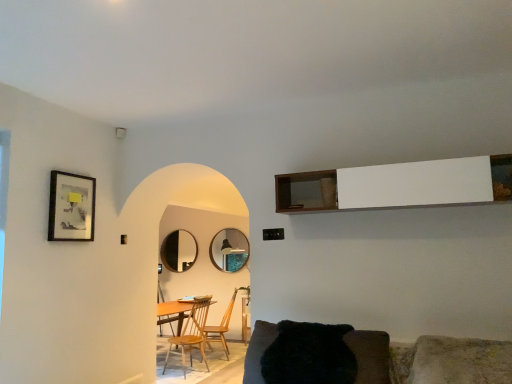
This screenshot has width=512, height=384. In order to click on matte black picture frame at upper left in this screenshot , I will do `click(71, 207)`.

What do you see at coordinates (221, 327) in the screenshot?
I see `wooden chair at center, acting as the second chair starting from the left` at bounding box center [221, 327].

Describe the element at coordinates (179, 251) in the screenshot. Image resolution: width=512 pixels, height=384 pixels. I see `matte black mirror at center, the first mirror when ordered from left to right` at that location.

The image size is (512, 384). I want to click on wooden at left, the 3th chair when ordered from right to left, so click(x=192, y=334).

From the picture: What is the approximate height of white wood cabinet at upper center?

13.22 inches.

In order to face white wood cabinet at upper center, should I rotate leftwards or rightwards?

Rotate your view right by about 16.617°.

Identify the location of matte silver mirror at center, which is the second mirror from back to front. The image size is (512, 384). (229, 250).

Considering the positions of points (85, 234) and (178, 240), is point (85, 234) farther from camera compared to point (178, 240)?

No, (85, 234) is closer to viewer.

Are matte black picture frame at upper left and matte black mirror at center, which is the 2th mirror in right-to-left order, beside each other?

They are not placed beside each other.

Could you tell me if matte black picture frame at upper left is facing matte black mirror at center, which is the 2th mirror in right-to-left order?

No, matte black picture frame at upper left is not aimed at matte black mirror at center, which is the 2th mirror in right-to-left order.

Is wooden chair at center, the second chair positioned from the right, far away from wooden at left, the 1th chair positioned from the left?

They are positioned close to each other.

Is point (228, 324) farther from camera compared to point (197, 329)?

Yes, it is.

Does wooden chair at center, the 1th chair viewed from the back, appear on the right side of wooden at left, the second chair when ordered from front to back?

Yes, wooden chair at center, the 1th chair viewed from the back, is to the right of wooden at left, the second chair when ordered from front to back.

Considering the sizes of objects wooden chair at center, which is the third chair from front to back, and wooden at left, the 1th chair positioned from the left, in the image provided, who is shorter, wooden chair at center, which is the third chair from front to back, or wooden at left, the 1th chair positioned from the left,?

With less height is wooden chair at center, which is the third chair from front to back.

Does wooden at left, the second chair when ordered from front to back, have a greater width compared to wooden chair at center, the 1th chair viewed from the back?

Correct, the width of wooden at left, the second chair when ordered from front to back, exceeds that of wooden chair at center, the 1th chair viewed from the back.

From the image's perspective, does wooden at left, arranged as the 2th chair when viewed from the back, appear lower than wooden chair at center, which is the third chair from front to back?

Actually, wooden at left, arranged as the 2th chair when viewed from the back, appears above wooden chair at center, which is the third chair from front to back, in the image.

Which point is more distant from viewer, (195, 312) or (205, 334)?

Positioned behind is point (195, 312).

Between wooden at left, arranged as the 2th chair when viewed from the back, and wooden chair at center, the 1th chair viewed from the back, which one appears on the right side from the viewer's perspective?

wooden chair at center, the 1th chair viewed from the back.

Is matte black mirror at center, which is the 2th mirror in right-to-left order, next to matte black picture frame at upper left?

matte black mirror at center, which is the 2th mirror in right-to-left order, and matte black picture frame at upper left are not in contact.

From a real-world perspective, which object stands above the other?

matte black picture frame at upper left, from a real-world perspective.

Would you say matte black mirror at center, which is the 1th mirror in back-to-front order, is outside matte black picture frame at upper left?

matte black mirror at center, which is the 1th mirror in back-to-front order, is positioned outside matte black picture frame at upper left.

Is point (170, 260) positioned in front of point (75, 201)?

No, (170, 260) is behind (75, 201).

In the scene shown: Can you see white wood cabinet at upper center touching matte silver mirror at center, which is the second mirror from back to front?

No, white wood cabinet at upper center is not in contact with matte silver mirror at center, which is the second mirror from back to front.

From the white wood cabinet at upper center, count the 1st mirror to the left and point to it. Please provide its 2D coordinates.

[(229, 250)]

Considering the relative sizes of white wood cabinet at upper center and matte silver mirror at center, which is the second mirror in left-to-right order, in the image provided, is white wood cabinet at upper center smaller than matte silver mirror at center, which is the second mirror in left-to-right order,?

Incorrect, white wood cabinet at upper center is not smaller in size than matte silver mirror at center, which is the second mirror in left-to-right order.

How many degrees apart are the facing directions of white wood cabinet at upper center and matte silver mirror at center, which is the second mirror in left-to-right order?

white wood cabinet at upper center and matte silver mirror at center, which is the second mirror in left-to-right order, are facing 0.865 degrees away from each other.

Is wooden at left, arranged as the 2th chair when viewed from the back, positioned beyond the bounds of matte black picture frame at upper left?

Yes, wooden at left, arranged as the 2th chair when viewed from the back, is located beyond the bounds of matte black picture frame at upper left.

Does wooden at left, the 1th chair positioned from the left, have a larger size compared to matte black picture frame at upper left?

Correct, wooden at left, the 1th chair positioned from the left, is larger in size than matte black picture frame at upper left.

Which is in front, point (187, 330) or point (58, 203)?

The point (58, 203) is closer.

Does wooden at left, the 3th chair when ordered from right to left, come in front of matte black picture frame at upper left?

That is False.

Who is smaller, white wood cabinet at upper center or matte black mirror at center, which is counted as the 2th mirror, starting from the front?

matte black mirror at center, which is counted as the 2th mirror, starting from the front.

Can you confirm if white wood cabinet at upper center is taller than matte black mirror at center, which is the 2th mirror in right-to-left order?

Incorrect, the height of white wood cabinet at upper center is not larger of that of matte black mirror at center, which is the 2th mirror in right-to-left order.

From the image's perspective, who appears lower, white wood cabinet at upper center or matte black mirror at center, which is the 1th mirror in back-to-front order?

matte black mirror at center, which is the 1th mirror in back-to-front order, from the image's perspective.

The image size is (512, 384). What are the coordinates of `the 2nd mirror behind the matte black picture frame at upper left` in the screenshot? It's located at (179, 251).

At what (x,y) coordinates should I click in order to perform the action: click on chair that is the 1st object above the wooden at left, the 3th chair when ordered from right to left (from a real-world perspective). Please return your answer as a coordinate pair (x, y). This screenshot has width=512, height=384. Looking at the image, I should click on (221, 327).

From the image, which object appears to be nearer to black furry chair at lower center, which appears as the third chair when viewed from the left, matte black picture frame at upper left or matte silver mirror at center, which is the second mirror in left-to-right order?

matte black picture frame at upper left is closer to black furry chair at lower center, which appears as the third chair when viewed from the left.

Which object lies further to the anchor point matte silver mirror at center, acting as the first mirror starting from the right, wooden chair at center, acting as the second chair starting from the left, or white wood cabinet at upper center?

Among the two, white wood cabinet at upper center is located further to matte silver mirror at center, acting as the first mirror starting from the right.

Looking at the image, which one is located further to matte black picture frame at upper left, wooden at left, the 3th chair when ordered from right to left, or matte silver mirror at center, acting as the first mirror starting from the right?

The object further to matte black picture frame at upper left is matte silver mirror at center, acting as the first mirror starting from the right.

Which object lies further to the anchor point wooden chair at center, acting as the second chair starting from the left, matte black picture frame at upper left or white wood cabinet at upper center?

The object further to wooden chair at center, acting as the second chair starting from the left, is white wood cabinet at upper center.

Which object lies further to the anchor point white wood cabinet at upper center, black furry chair at lower center, which is counted as the 1th chair, starting from the front, or wooden at left, the 1th chair positioned from the left?

wooden at left, the 1th chair positioned from the left, lies further to white wood cabinet at upper center than the other object.

In the scene shown: Estimate the real-world distances between objects in this image. Which object is further from black furry chair at lower center, acting as the third chair starting from the back, wooden at left, arranged as the 2th chair when viewed from the back, or matte black picture frame at upper left?

wooden at left, arranged as the 2th chair when viewed from the back, is positioned further to the anchor black furry chair at lower center, acting as the third chair starting from the back.

Which object lies nearer to the anchor point white wood cabinet at upper center, matte black mirror at center, which is the 1th mirror in back-to-front order, or wooden chair at center, which is the third chair from front to back?

matte black mirror at center, which is the 1th mirror in back-to-front order, is closer to white wood cabinet at upper center.

In the scene shown: Estimate the real-world distances between objects in this image. Which object is further from matte silver mirror at center, which is the second mirror from back to front, wooden chair at center, acting as the second chair starting from the left, or wooden at left, arranged as the 2th chair when viewed from the back?

wooden at left, arranged as the 2th chair when viewed from the back.

I want to click on chair located between wooden at left, the 3th chair when ordered from right to left, and matte silver mirror at center, which is the second mirror from back to front, in the depth direction, so click(x=221, y=327).

Find the location of a particular element. The image size is (512, 384). picture frame between black furry chair at lower center, which appears as the third chair when viewed from the left, and matte silver mirror at center, which is the second mirror in left-to-right order, from front to back is located at coordinates (71, 207).

Locate an element on the screen. chair between wooden at left, the 3th chair when ordered from right to left, and matte black mirror at center, which is the 1th mirror in back-to-front order, along the z-axis is located at coordinates tap(221, 327).

The image size is (512, 384). In order to click on picture frame positioned between white wood cabinet at upper center and matte silver mirror at center, acting as the first mirror starting from the right, from near to far in this screenshot , I will do `click(71, 207)`.